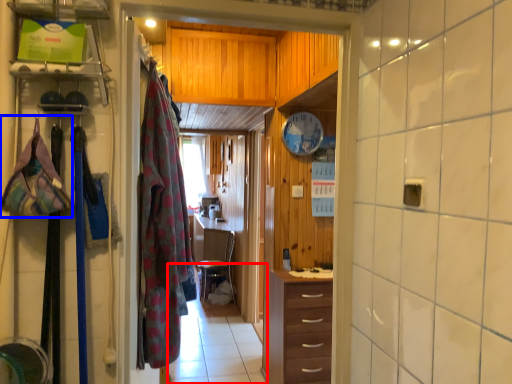
Question: Which of the following is the closest to the observer, path (highlighted by a red box) or clothing (highlighted by a blue box)?

Choices:
 (A) path
 (B) clothing

Answer: (B)